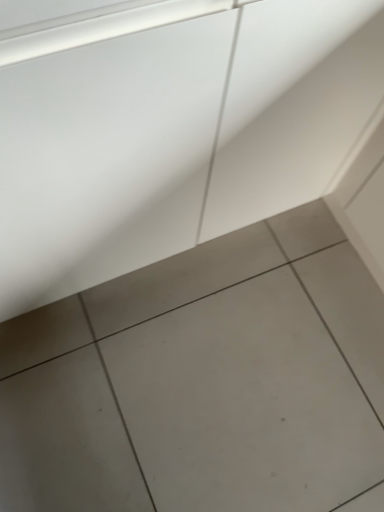
Question: Considering the relative positions of white smooth concrete at center and gray matte tile at center in the image provided, is white smooth concrete at center to the left of gray matte tile at center from the viewer's perspective?

Choices:
 (A) yes
 (B) no

Answer: (B)

Question: Considering the relative sizes of white smooth concrete at center and gray matte tile at center in the image provided, is white smooth concrete at center thinner than gray matte tile at center?

Choices:
 (A) no
 (B) yes

Answer: (B)

Question: Can you confirm if white smooth concrete at center is bigger than gray matte tile at center?

Choices:
 (A) yes
 (B) no

Answer: (A)

Question: From the image's perspective, is white smooth concrete at center over gray matte tile at center?

Choices:
 (A) no
 (B) yes

Answer: (B)

Question: Is white smooth concrete at center beside gray matte tile at center?

Choices:
 (A) yes
 (B) no

Answer: (B)

Question: Does white smooth concrete at center appear on the right side of gray matte tile at center?

Choices:
 (A) no
 (B) yes

Answer: (B)

Question: Is the position of gray matte tile at center more distant than that of white smooth concrete at center?

Choices:
 (A) yes
 (B) no

Answer: (A)

Question: Is gray matte tile at center completely or partially outside of white smooth concrete at center?

Choices:
 (A) no
 (B) yes

Answer: (B)

Question: Considering the relative sizes of gray matte tile at center and white smooth concrete at center in the image provided, is gray matte tile at center taller than white smooth concrete at center?

Choices:
 (A) no
 (B) yes

Answer: (A)

Question: Is gray matte tile at center in front of white smooth concrete at center?

Choices:
 (A) no
 (B) yes

Answer: (A)

Question: From a real-world perspective, is gray matte tile at center physically below white smooth concrete at center?

Choices:
 (A) no
 (B) yes

Answer: (B)

Question: Is white smooth concrete at center completely or partially inside gray matte tile at center?

Choices:
 (A) no
 (B) yes

Answer: (A)

Question: In terms of height, does gray matte tile at center look taller or shorter compared to white smooth concrete at center?

Choices:
 (A) tall
 (B) short

Answer: (B)